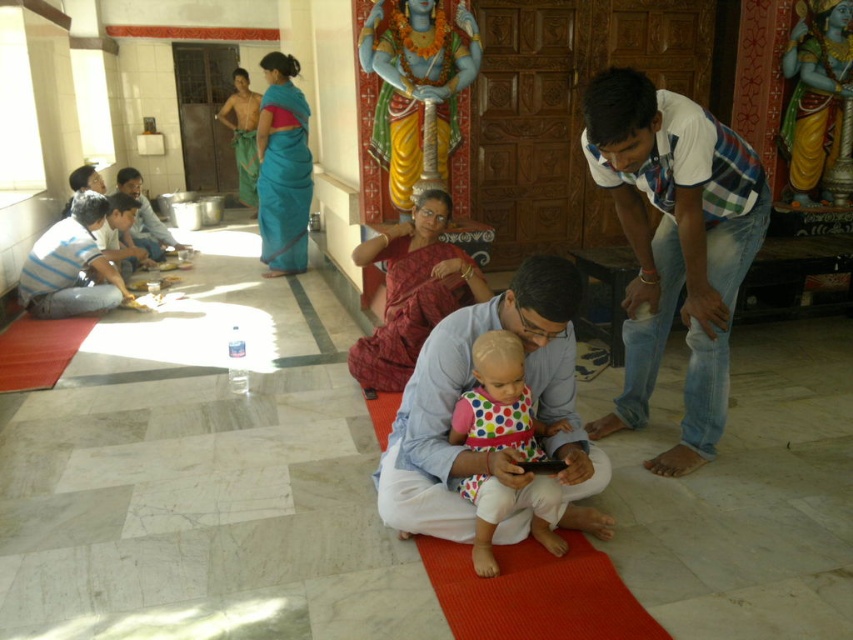
Question: Among these points, which one is nearest to the camera?

Choices:
 (A) (389, 269)
 (B) (53, 308)
 (C) (241, 100)
 (D) (523, 412)

Answer: (D)

Question: Which object is farther from the camera taking this photo?

Choices:
 (A) striped cotton shirt at left
 (B) matte blue shirt at center
 (C) teal silk saree at upper center

Answer: (C)

Question: Does white cotton shirt at right appear under teal silk saree at center?

Choices:
 (A) no
 (B) yes

Answer: (B)

Question: Does red silk saree at center have a smaller size compared to teal silk saree at center?

Choices:
 (A) yes
 (B) no

Answer: (A)

Question: Among these objects, which one is farthest from the camera?

Choices:
 (A) red silk saree at center
 (B) teal silk saree at upper center
 (C) striped cotton shirt at left

Answer: (B)

Question: Can you confirm if white cotton shirt at right is positioned below polka dot fabric dress at center?

Choices:
 (A) yes
 (B) no

Answer: (B)